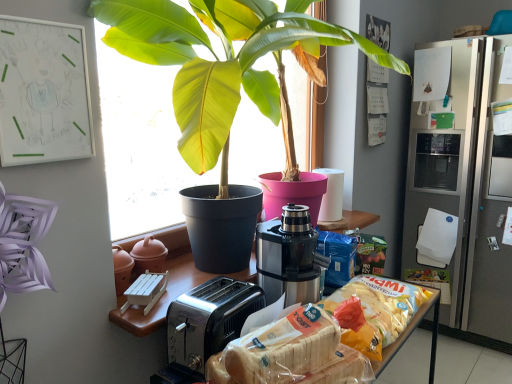
Question: Can you confirm if white plastic bread at lower center, arranged as the first snack when viewed from the front, is thinner than stainless steel coffee machine at center?

Choices:
 (A) yes
 (B) no

Answer: (A)

Question: Can you confirm if white plastic bread at lower center, arranged as the first snack when viewed from the front, is taller than stainless steel coffee machine at center?

Choices:
 (A) yes
 (B) no

Answer: (B)

Question: Does white plastic bread at lower center, the 2th snack positioned from the back, come behind stainless steel coffee machine at center?

Choices:
 (A) yes
 (B) no

Answer: (B)

Question: Is white plastic bread at lower center, arranged as the first snack when viewed from the front, directly adjacent to stainless steel coffee machine at center?

Choices:
 (A) yes
 (B) no

Answer: (B)

Question: Is white plastic bread at lower center, the 2th snack positioned from the back, bigger than stainless steel coffee machine at center?

Choices:
 (A) no
 (B) yes

Answer: (A)

Question: From a real-world perspective, is green glossy leafy plant at center positioned above or below translucent plastic bag of chips at center, which is the first snack in back-to-front order?

Choices:
 (A) below
 (B) above

Answer: (B)

Question: Considering the positions of green glossy leafy plant at center and translucent plastic bag of chips at center, which is the first snack in back-to-front order, in the image, is green glossy leafy plant at center taller or shorter than translucent plastic bag of chips at center, which is the first snack in back-to-front order,?

Choices:
 (A) short
 (B) tall

Answer: (B)

Question: From the image's perspective, is green glossy leafy plant at center located above or below translucent plastic bag of chips at center, which is the first snack in back-to-front order?

Choices:
 (A) below
 (B) above

Answer: (B)

Question: Looking at their shapes, would you say green glossy leafy plant at center is wider or thinner than translucent plastic bag of chips at center, which is the first snack in back-to-front order?

Choices:
 (A) wide
 (B) thin

Answer: (A)

Question: Is point click(x=281, y=26) positioned closer to the camera than point click(x=257, y=254)?

Choices:
 (A) closer
 (B) farther

Answer: (A)

Question: Looking at their shapes, would you say green glossy leafy plant at center is wider or thinner than stainless steel coffee machine at center?

Choices:
 (A) wide
 (B) thin

Answer: (A)

Question: Looking at the image, does green glossy leafy plant at center seem bigger or smaller compared to stainless steel coffee machine at center?

Choices:
 (A) small
 (B) big

Answer: (B)

Question: Relative to stainless steel coffee machine at center, is green glossy leafy plant at center in front or behind?

Choices:
 (A) behind
 (B) front

Answer: (B)

Question: From the image's perspective, relative to stainless steel coffee machine at center, is translucent plastic bag of chips at center, the second snack when ordered from front to back, above or below?

Choices:
 (A) above
 (B) below

Answer: (B)

Question: Is translucent plastic bag of chips at center, which is the first snack in back-to-front order, wider or thinner than stainless steel coffee machine at center?

Choices:
 (A) thin
 (B) wide

Answer: (A)